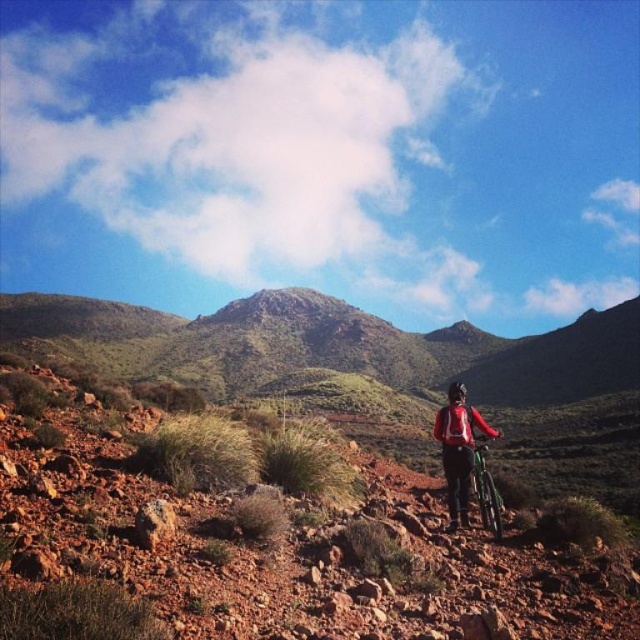
Question: Is the position of red matte jacket at center less distant than that of green metallic mountain bike at center?

Choices:
 (A) yes
 (B) no

Answer: (B)

Question: Is red matte jacket at center further to camera compared to green metallic mountain bike at center?

Choices:
 (A) no
 (B) yes

Answer: (B)

Question: Which point is closer to the camera?

Choices:
 (A) (492, 480)
 (B) (468, 428)

Answer: (A)

Question: Can you confirm if red matte jacket at center is positioned to the left of green metallic mountain bike at center?

Choices:
 (A) yes
 (B) no

Answer: (B)